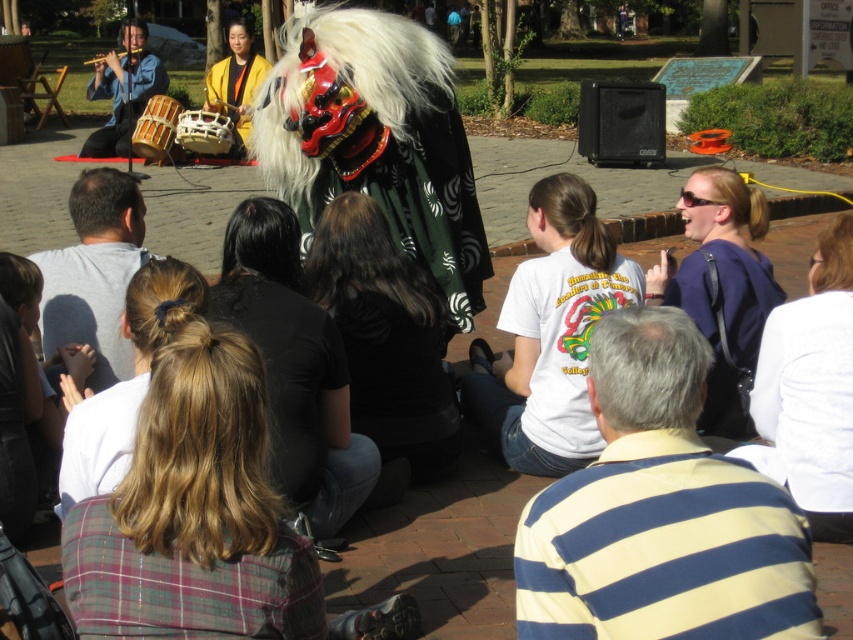
Image resolution: width=853 pixels, height=640 pixels. What do you see at coordinates (94, 273) in the screenshot?
I see `gray cotton shirt at center` at bounding box center [94, 273].

Is point (99, 244) positioned in front of point (103, 61)?

That is True.

Where is `gray cotton shirt at center`? The height and width of the screenshot is (640, 853). gray cotton shirt at center is located at coordinates tap(94, 273).

Is gray cotton shirt at center positioned before yellow fabric drum at upper center?

That is True.

Is gray cotton shirt at center taller than yellow fabric drum at upper center?

Incorrect, gray cotton shirt at center's height is not larger of yellow fabric drum at upper center's.

Describe the element at coordinates (94, 273) in the screenshot. I see `gray cotton shirt at center` at that location.

You are a GUI agent. You are given a task and a screenshot of the screen. Output one action in this format:
    pyautogui.click(x=<x>, y=<y>)
    Task: Click on the gray cotton shirt at center
    This screenshot has width=853, height=640.
    Given the screenshot: What is the action you would take?
    pyautogui.click(x=94, y=273)

This screenshot has height=640, width=853. I want to click on striped cotton shirt at center, so click(660, 513).

Is striped cotton shirt at center to the left of matte black costume at center from the viewer's perspective?

Incorrect, striped cotton shirt at center is not on the left side of matte black costume at center.

Which is in front, point (752, 509) or point (300, 92)?

Point (752, 509)

At what (x,y) coordinates should I click in order to perform the action: click on striped cotton shirt at center. Please return your answer as a coordinate pair (x, y). The width and height of the screenshot is (853, 640). Looking at the image, I should click on (660, 513).